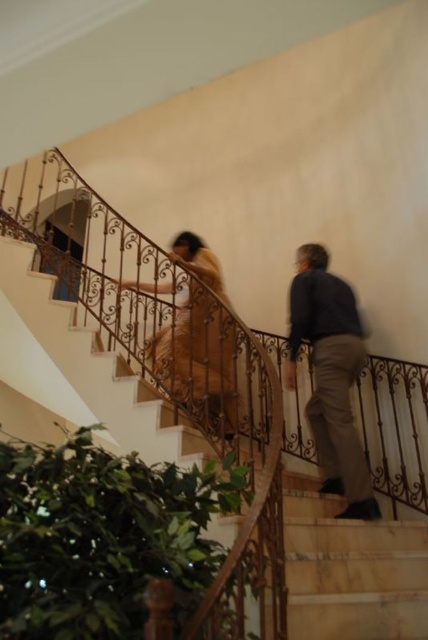
Question: Can you confirm if dark blue shirt at right is wider than brown textured dress at center?

Choices:
 (A) no
 (B) yes

Answer: (A)

Question: Estimate the real-world distances between objects in this image. Which object is closer to the marble stairs at center?

Choices:
 (A) dark blue shirt at right
 (B) tan fabric dress at center

Answer: (A)

Question: Which point appears closest to the camera in this image?

Choices:
 (A) (89, 420)
 (B) (312, 275)
 (C) (330, 392)
 (D) (211, 369)

Answer: (C)

Question: Which point is farther to the camera?

Choices:
 (A) dark blue shirt at right
 (B) tan fabric dress at center
 (C) brown textured dress at center
 (D) marble stairs at center

Answer: (B)

Question: Is tan fabric dress at center below brown textured dress at center?

Choices:
 (A) yes
 (B) no

Answer: (A)

Question: Is tan fabric dress at center wider than dark blue shirt at right?

Choices:
 (A) no
 (B) yes

Answer: (B)